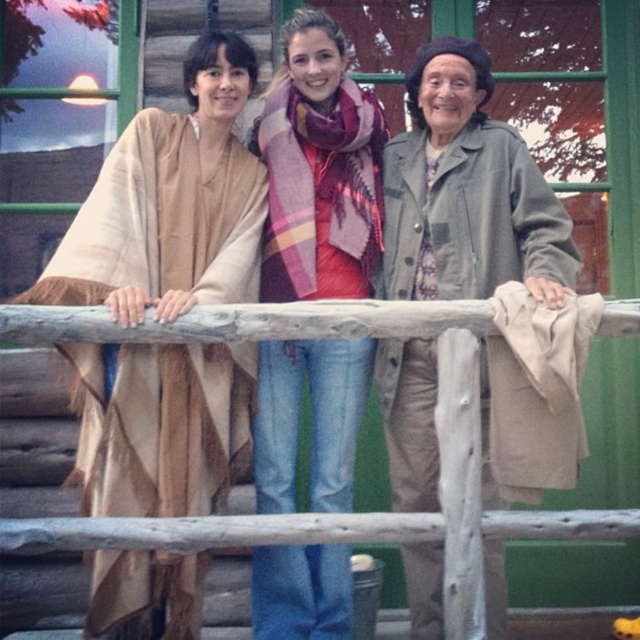
From the picture: Is plaid scarf at center positioned behind wooden at center?

That is True.

Identify the location of plaid scarf at center. The width and height of the screenshot is (640, 640). (320, 170).

In order to click on plaid scarf at center in this screenshot , I will do `click(320, 170)`.

Which of these two, beige woven poncho at left or wooden at center, stands shorter?

With less height is wooden at center.

Can you confirm if beige woven poncho at left is smaller than wooden at center?

No, beige woven poncho at left is not smaller than wooden at center.

Does point (77, 304) come closer to viewer compared to point (621, 534)?

No, (77, 304) is behind (621, 534).

The width and height of the screenshot is (640, 640). Identify the location of beige woven poncho at left. (170, 204).

Does beige woven poncho at left have a lesser height compared to plaid wool scarf at center?

No, beige woven poncho at left is not shorter than plaid wool scarf at center.

Can you confirm if beige woven poncho at left is positioned above plaid wool scarf at center?

No.

I want to click on beige woven poncho at left, so click(170, 204).

In order to click on beige woven poncho at left in this screenshot , I will do `click(170, 204)`.